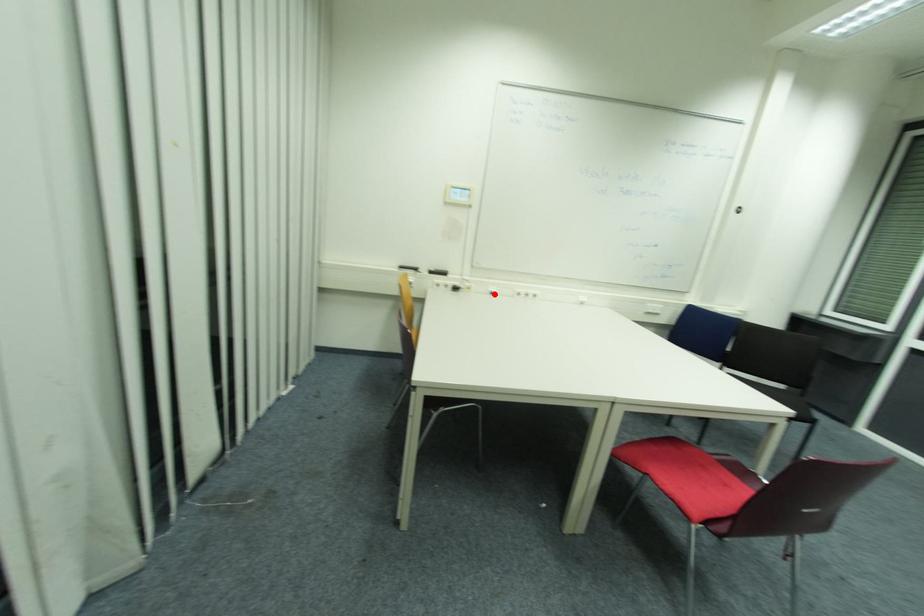
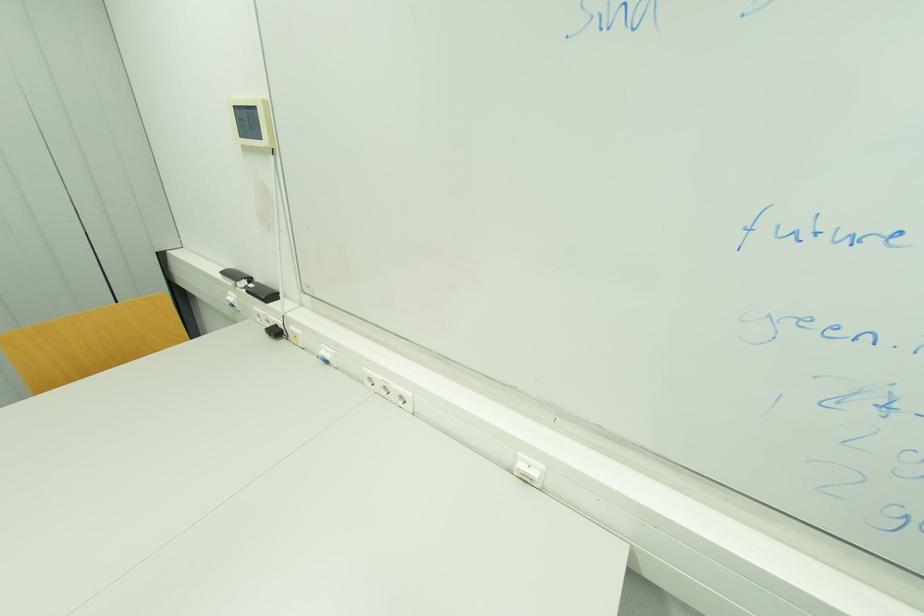
Where in the second image is the point corresponding to the highlighted location from the first image?

(330, 362)